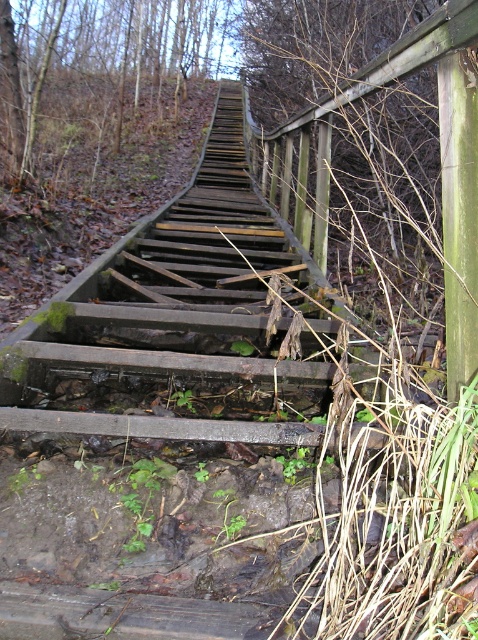
Question: Can you confirm if weathered wood stairs at center is positioned to the left of green leafy weed at center?

Choices:
 (A) yes
 (B) no

Answer: (B)

Question: Is weathered wood stairs at center to the right of green leafy weed at center from the viewer's perspective?

Choices:
 (A) yes
 (B) no

Answer: (A)

Question: From the image, what is the correct spatial relationship of weathered wood stairs at center in relation to green leafy weed at center?

Choices:
 (A) left
 (B) right

Answer: (B)

Question: Among these points, which one is nearest to the camera?

Choices:
 (A) (239, 324)
 (B) (184, 406)

Answer: (B)